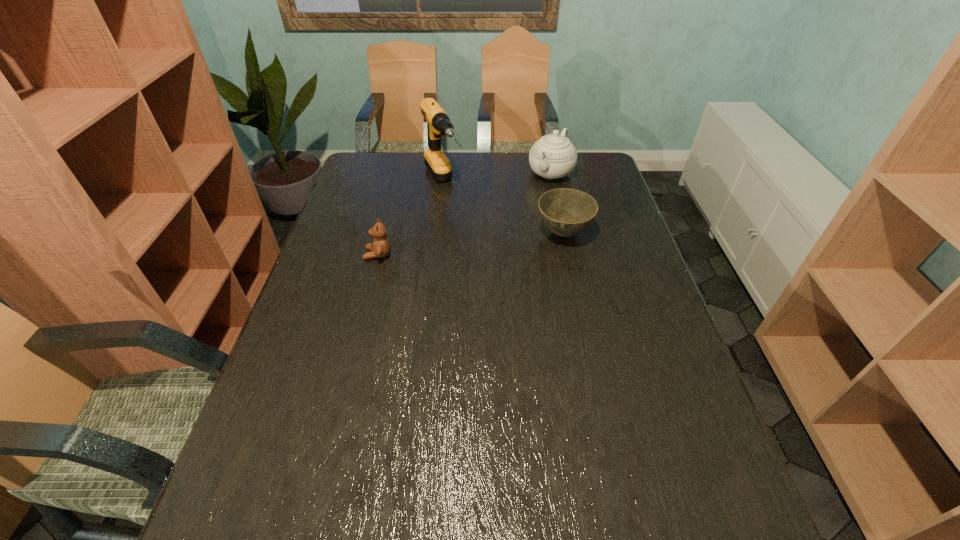
At what (x,y) coordinates should I click in order to perform the action: click on vacant region at the near edge. Please return your answer as a coordinate pair (x, y). This screenshot has width=960, height=540. Looking at the image, I should click on (394, 459).

At what (x,y) coordinates should I click in order to perform the action: click on vacant space at the left edge of the desktop. Please return your answer as a coordinate pair (x, y). Looking at the image, I should click on (346, 311).

Identify the location of free region at the right edge. Image resolution: width=960 pixels, height=540 pixels. (x=652, y=333).

Image resolution: width=960 pixels, height=540 pixels. Identify the location of free space at the far left corner of the desktop. (397, 168).

At what (x,y) coordinates should I click in order to perform the action: click on vacant space at the near left corner of the desktop. Please return your answer as a coordinate pair (x, y). Looking at the image, I should click on (249, 442).

In the image, there is a desktop. Where is `free space at the near right corner`? This screenshot has width=960, height=540. free space at the near right corner is located at coordinates (676, 444).

The height and width of the screenshot is (540, 960). Find the location of `free spot between the drill and the bowl`. free spot between the drill and the bowl is located at coordinates (503, 208).

In order to click on vacant region between the teddy bear and the chinaware in this screenshot , I will do `click(465, 214)`.

In order to click on empty location between the bowl and the tallest object in this screenshot , I will do `click(503, 208)`.

The height and width of the screenshot is (540, 960). What are the coordinates of `vacant space that is in between the second tallest object and the teddy bear` in the screenshot? It's located at (465, 214).